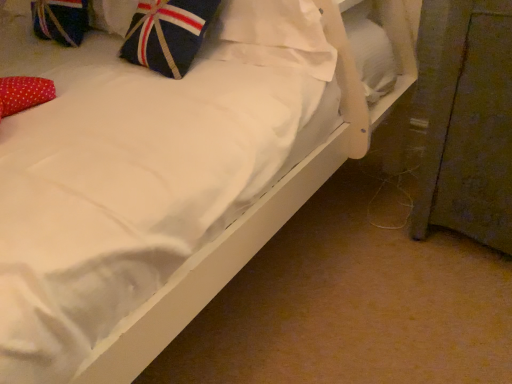
Describe the element at coordinates (466, 120) in the screenshot. I see `wooden dresser at lower right` at that location.

You are a GUI agent. You are given a task and a screenshot of the screen. Output one action in this format:
    pyautogui.click(x=<x>, y=<y>)
    Task: Click on the wooden dresser at lower right
    
    Given the screenshot: What is the action you would take?
    pyautogui.click(x=466, y=120)

Locate an element on the screen. This screenshot has height=384, width=512. wooden dresser at lower right is located at coordinates coord(466,120).